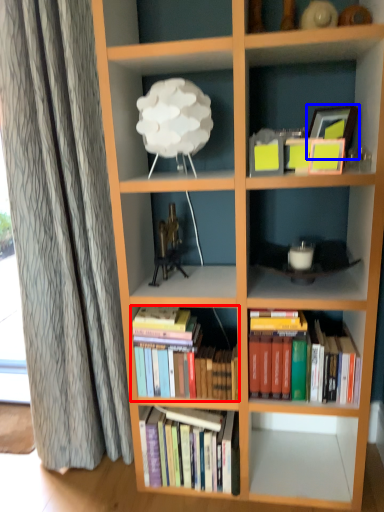
Question: Which object is further to the camera taking this photo, book (highlighted by a red box) or picture frame (highlighted by a blue box)?

Choices:
 (A) book
 (B) picture frame

Answer: (A)